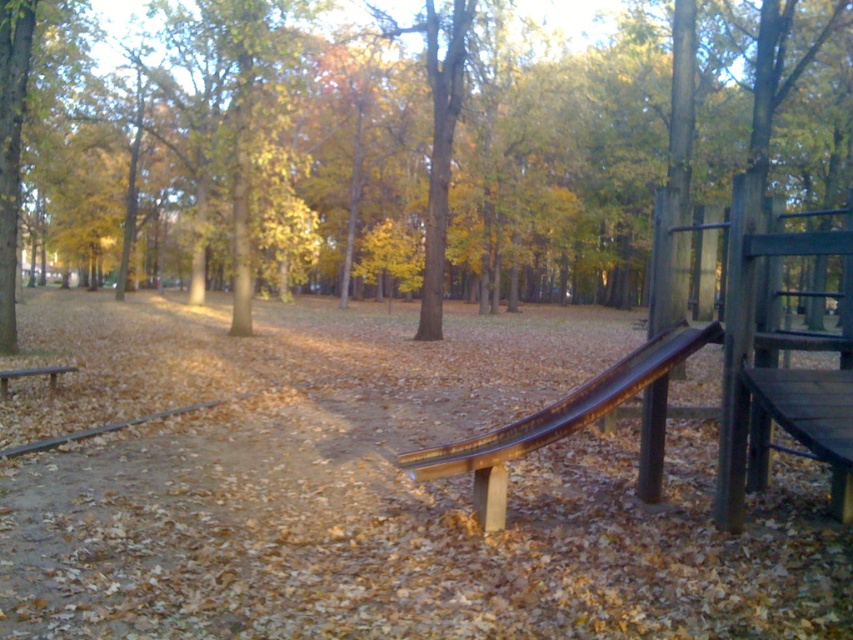
From the picture: You are a parent trying to decide where to sit while watching your child play on the slide. You prefer a larger bench for comfort. Which bench should you choose between the wooden bench at center and the wooden bench at left?

The wooden bench at center is bigger than the wooden bench at left, so you should choose the wooden bench at center for more comfort.

Consider the image. You are a child playing in the autumn park and want to sit on one of the wooden benches. Which bench, the wooden bench at center or the wooden bench at left, is closer to you?

The wooden bench at center is closer to you than the wooden bench at left.